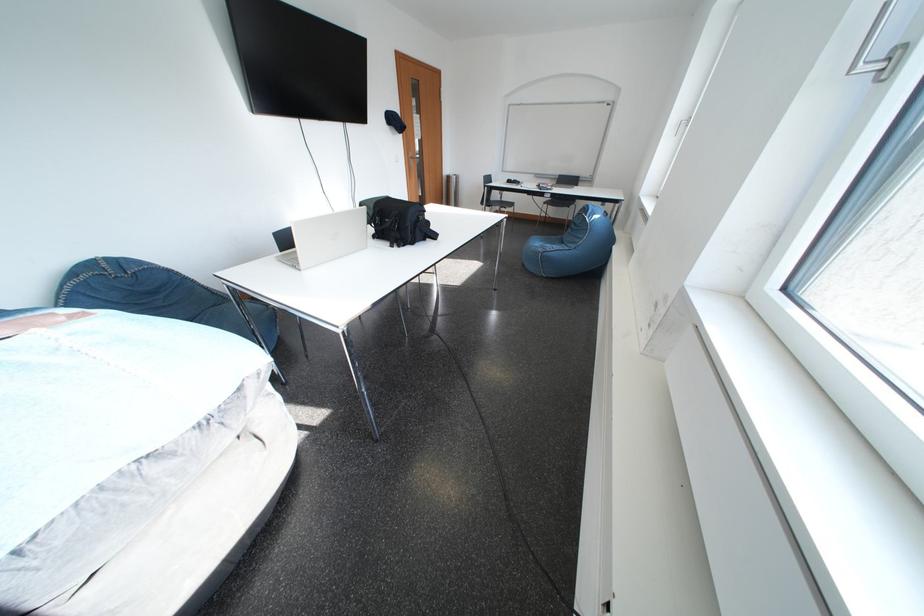
What do you see at coordinates (894, 26) in the screenshot? I see `the silver window handle` at bounding box center [894, 26].